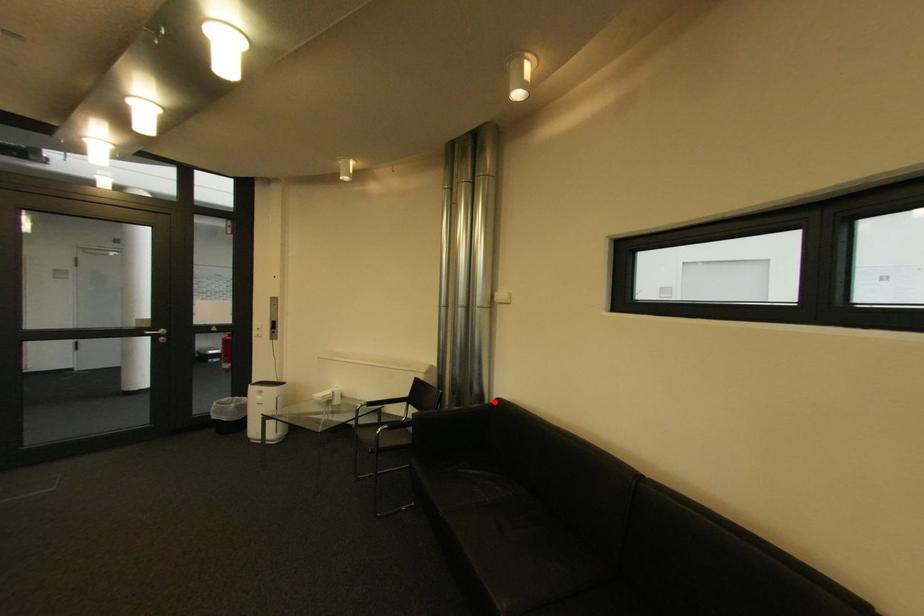
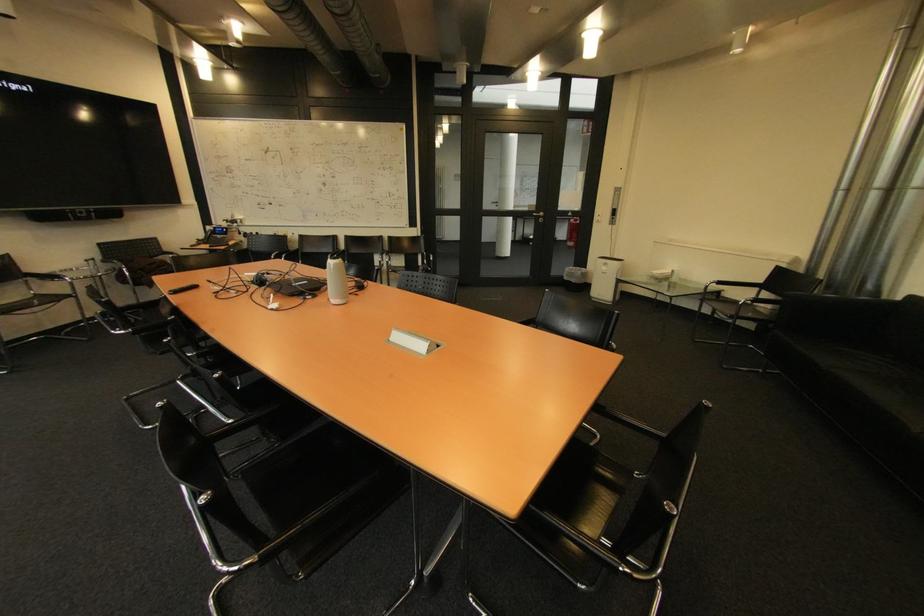
The point at the highlighted location is marked in the first image. Where is the corresponding point in the second image?

(893, 300)